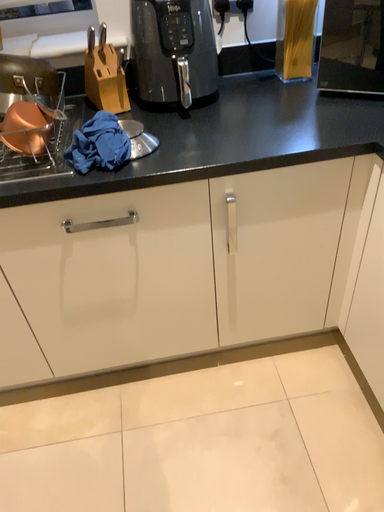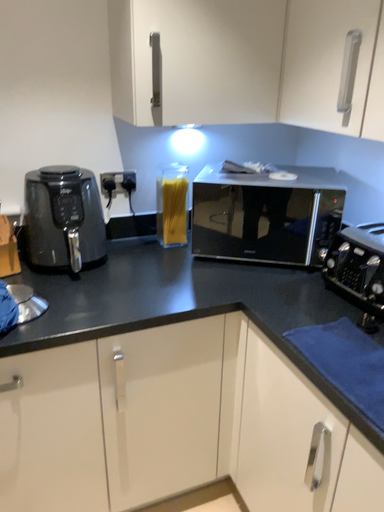
Question: How did the camera likely rotate when shooting the video?

Choices:
 (A) rotated left
 (B) rotated right

Answer: (B)